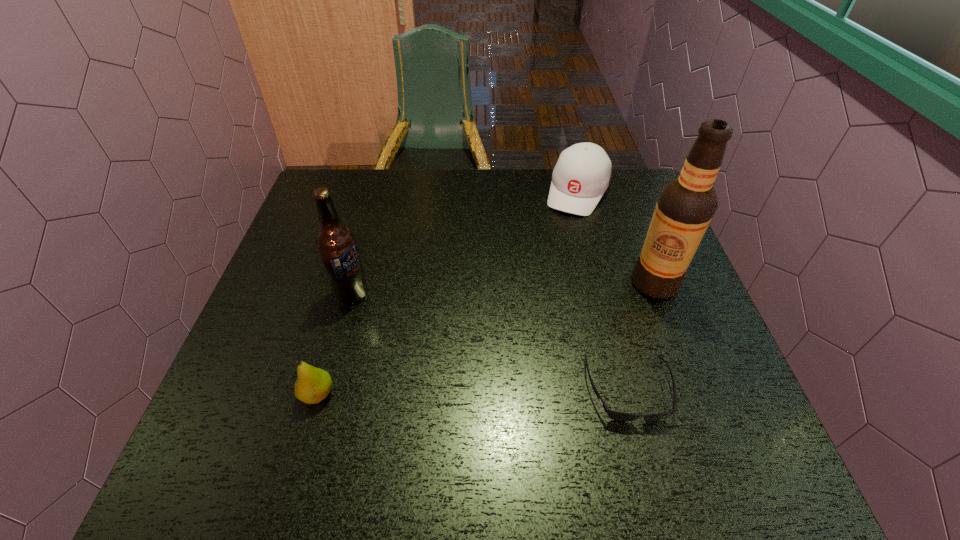
Locate an element on the screen. free point between the farthest object and the alcohol is located at coordinates (616, 237).

Image resolution: width=960 pixels, height=540 pixels. I want to click on free area in between the farthest object and the shortest object, so click(x=603, y=291).

At what (x,y) coordinates should I click in order to perform the action: click on empty location between the tallest object and the beer bottle. Please return your answer as a coordinate pair (x, y). Image resolution: width=960 pixels, height=540 pixels. Looking at the image, I should click on (503, 288).

The image size is (960, 540). In order to click on free point between the pear and the shortest object in this screenshot , I will do `click(473, 393)`.

Find the location of a particular element. free spot between the pear and the alcohol is located at coordinates (487, 339).

Locate an element on the screen. free space between the pear and the baseball cap is located at coordinates (448, 293).

This screenshot has height=540, width=960. I want to click on empty space between the beer bottle and the tallest object, so click(x=503, y=288).

Where is `free space that is in between the alcohol and the baseball cap`? The image size is (960, 540). free space that is in between the alcohol and the baseball cap is located at coordinates (616, 237).

Image resolution: width=960 pixels, height=540 pixels. Find the location of `vacant space that is in between the second tallest object and the baseball cap`. vacant space that is in between the second tallest object and the baseball cap is located at coordinates (465, 243).

Where is `vacant area that lies between the farthest object and the shortest object`? Image resolution: width=960 pixels, height=540 pixels. vacant area that lies between the farthest object and the shortest object is located at coordinates (603, 291).